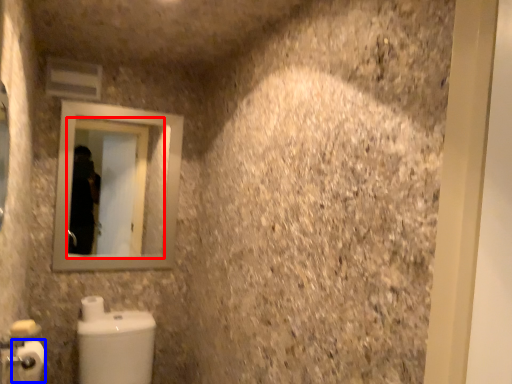
Question: Which object appears closest to the camera in this image, mirror (highlighted by a red box) or toilet paper (highlighted by a blue box)?

Choices:
 (A) mirror
 (B) toilet paper

Answer: (B)